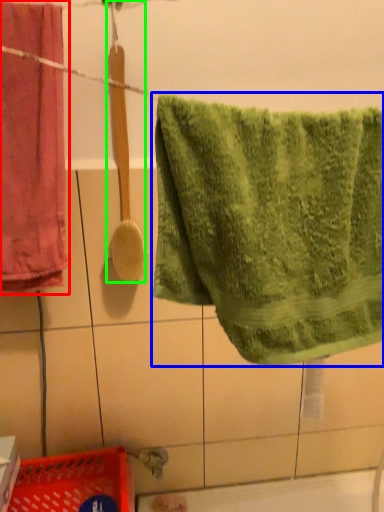
Question: Which object is the farthest from towel (highlighted by a red box)? Choose among these: towel (highlighted by a blue box) or brush (highlighted by a green box).

Choices:
 (A) towel
 (B) brush

Answer: (A)